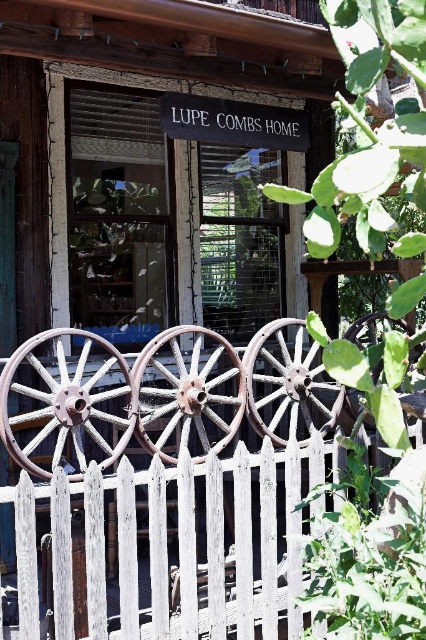
Does rusty metal wagon wheel at lower left appear on the right side of rusty wood wagon wheel at center?

No, rusty metal wagon wheel at lower left is not to the right of rusty wood wagon wheel at center.

Between rusty metal wagon wheel at lower left and rusty wood wagon wheel at center, which one is positioned higher?

rusty wood wagon wheel at center is higher up.

This screenshot has height=640, width=426. What do you see at coordinates (66, 403) in the screenshot? I see `rusty metal wagon wheel at lower left` at bounding box center [66, 403].

The image size is (426, 640). I want to click on rusty metal wagon wheel at lower left, so click(x=66, y=403).

Does point (304, 422) come farther from viewer compared to point (357, 340)?

That is True.

Is rusty metal wagon wheel at center smaller than rusty metal wheel at center?

No.

Identify the location of rusty metal wagon wheel at center. (288, 384).

Identify the location of rusty metal wagon wheel at center. (288, 384).

Which is above, rusty metal wagon wheel at lower left or rusty metal wagon wheel at center?

rusty metal wagon wheel at center

The height and width of the screenshot is (640, 426). What are the coordinates of `rusty metal wagon wheel at lower left` in the screenshot? It's located at (66, 403).

I want to click on rusty metal wagon wheel at lower left, so click(66, 403).